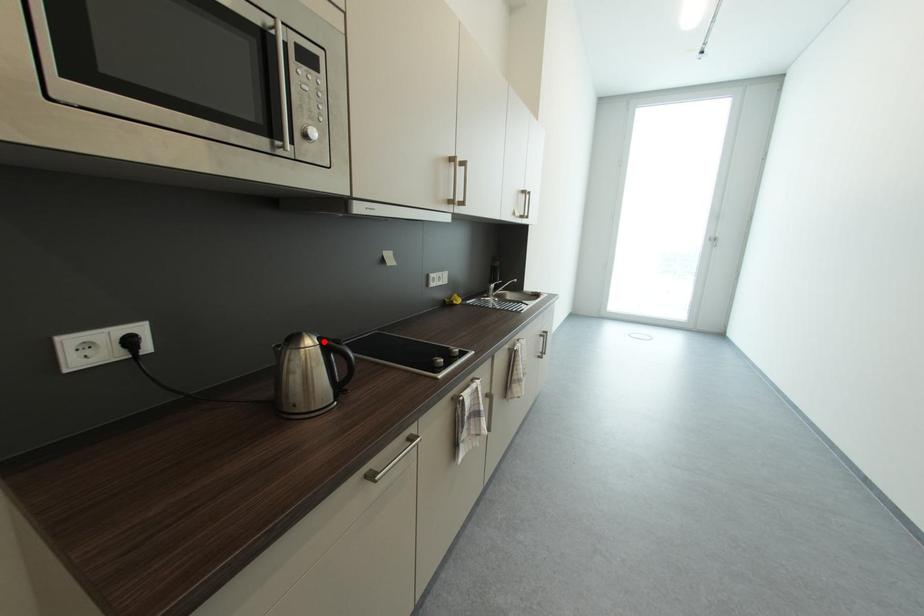
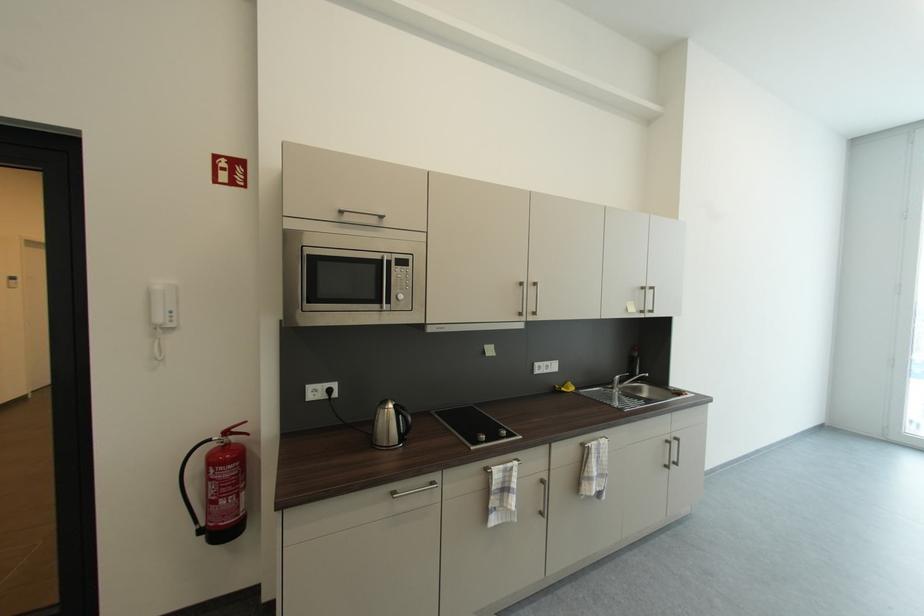
Locate, in the second image, the point that corresponds to the highlighted location in the first image.

(400, 407)